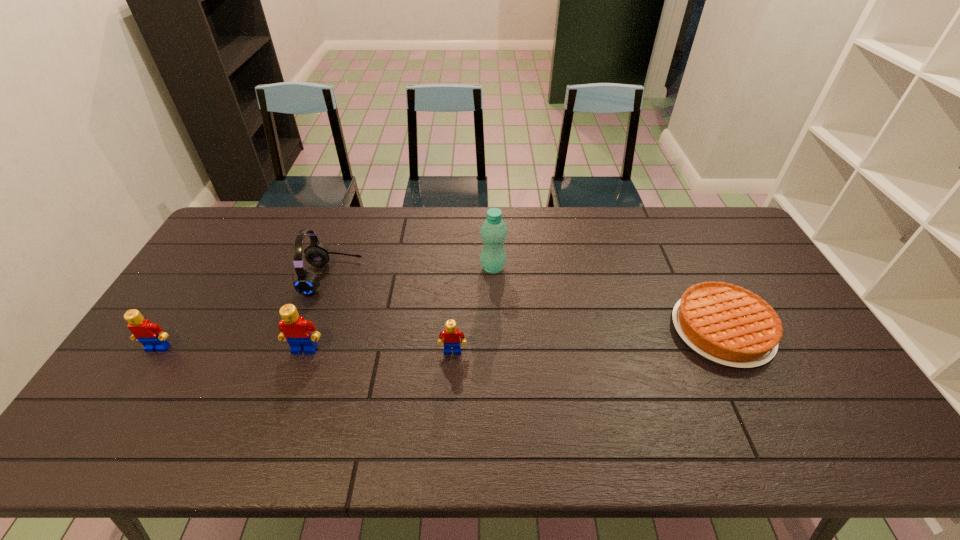
In the image, there is a desktop. Where is `vacant space at the far right corner`? The image size is (960, 540). vacant space at the far right corner is located at coordinates (684, 214).

The height and width of the screenshot is (540, 960). In order to click on vacant area that lies between the third shortest object and the headset in this screenshot , I will do `click(245, 313)`.

Identify the location of free space that is in between the rightmost object and the rightmost Lego. The width and height of the screenshot is (960, 540). (588, 341).

Locate an element on the screen. The width and height of the screenshot is (960, 540). empty space between the fifth object from left to right and the rightmost Lego is located at coordinates (473, 309).

Locate an element on the screen. This screenshot has height=540, width=960. vacant area that lies between the third object from right to left and the headset is located at coordinates (392, 314).

At what (x,y) coordinates should I click in order to perform the action: click on vacant area that lies between the fourth object from left to right and the second Lego from left to right. Please return your answer as a coordinate pair (x, y). This screenshot has height=540, width=960. Looking at the image, I should click on (379, 350).

Identify the location of vacant area that lies between the leftmost object and the tallest object. Image resolution: width=960 pixels, height=540 pixels. (325, 308).

Find the location of `free spot between the headset and the second Lego from left to right`. free spot between the headset and the second Lego from left to right is located at coordinates (318, 313).

Find the location of a particular element. The width and height of the screenshot is (960, 540). free space between the second tallest Lego and the second Lego from left to right is located at coordinates (231, 349).

The image size is (960, 540). Find the location of `vacant area between the second Lego from left to right and the rightmost Lego`. vacant area between the second Lego from left to right and the rightmost Lego is located at coordinates (379, 350).